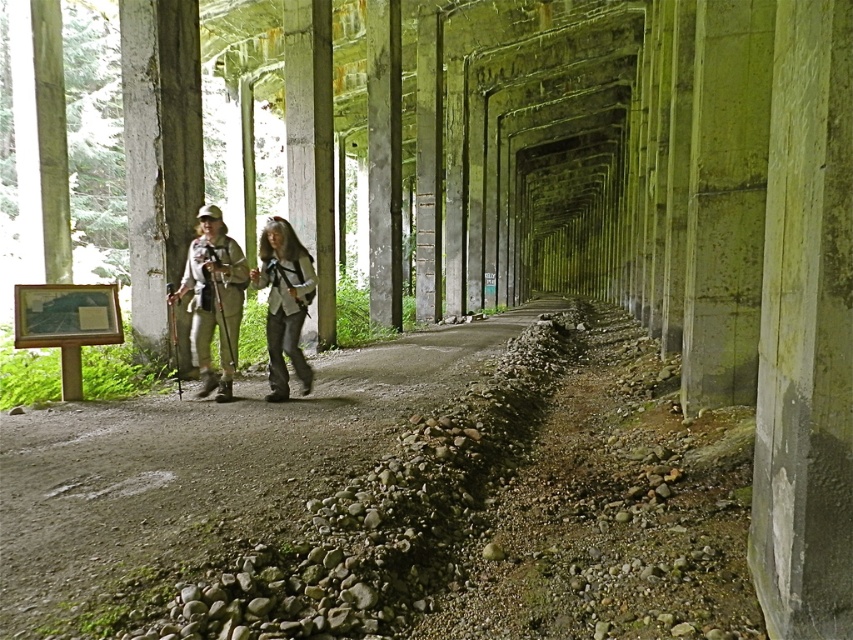
You are a hiker who has just entered the abandoned railway tunnel. You notice your matte khaki pants at center and your gray fabric backpack at center. Which item is closer to the tunnel entrance?

The matte khaki pants at center is positioned over the gray fabric backpack at center, so the matte khaki pants at center is closer to the tunnel entrance.

You are a hiker who has just entered the abandoned railway tunnel. You notice your matte khaki pants at center and your gray fabric backpack at center. Which item is positioned to the left when viewed from your perspective inside the tunnel?

The matte khaki pants at center are to the left of the gray fabric backpack at center.